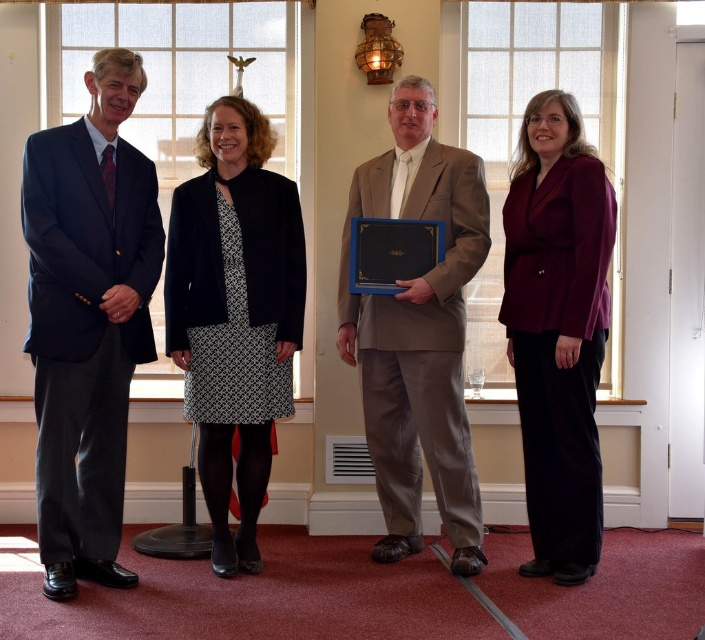
You are a photographer at a formal event and need to capture a photo of the black textured skirt at center and the burgundy satin blazer at right. Based on their positions, which one should you focus on first to ensure both are in frame?

The black textured skirt at center is positioned on the left side of the burgundy satin blazer at right, so you should focus on the black textured skirt at center first to ensure both are in frame.

You are organizing a photoshoot and need to ensure that the black textured skirt at center and the burgundy satin blazer at right are both visible in the frame. Given their sizes, which item might require more careful positioning to avoid being cropped out?

The burgundy satin blazer at right occupies more space than the black textured skirt at center, so it might require more careful positioning to avoid being cropped out.

You are a photographer setting up for a group photo. You need to ensure that the black textured skirt at center and the tan fabric suit at center are within a 25 inch frame. Based on their current positions, will they fit within the frame?

The distance between the black textured skirt at center and the tan fabric suit at center is 24.73 inches, which is less than 25 inches. Therefore, they will fit within the frame.